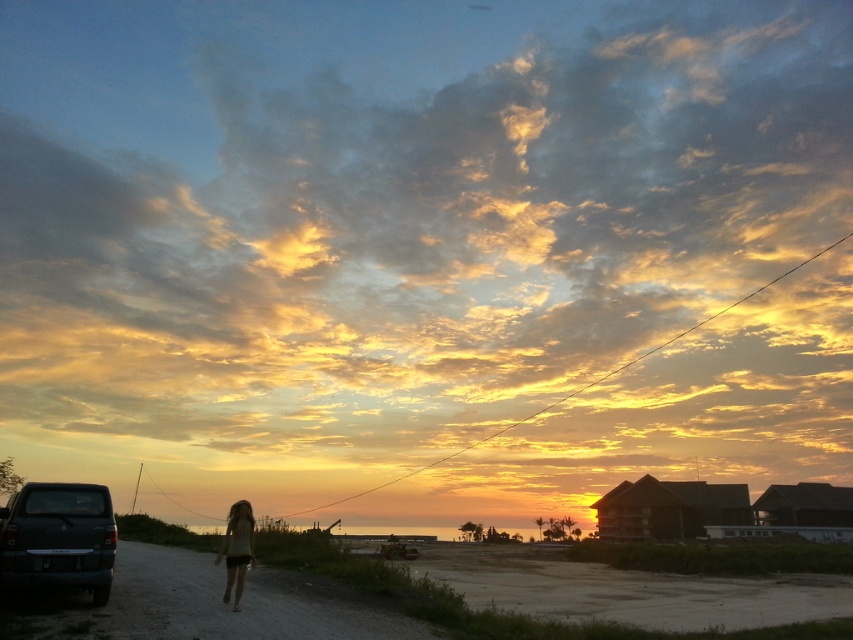
Question: Among these points, which one is nearest to the camera?

Choices:
 (A) (228, 532)
 (B) (45, 525)

Answer: (B)

Question: Does matte black truck at lower left appear on the left side of beige cotton shorts at lower left?

Choices:
 (A) yes
 (B) no

Answer: (B)

Question: Does matte black truck at lower left appear on the right side of beige cotton shorts at lower left?

Choices:
 (A) yes
 (B) no

Answer: (A)

Question: Can you confirm if matte black truck at lower left is wider than beige cotton shorts at lower left?

Choices:
 (A) no
 (B) yes

Answer: (A)

Question: Which object appears closest to the camera in this image?

Choices:
 (A) beige cotton shorts at lower left
 (B) matte black truck at lower left

Answer: (B)

Question: Among these points, which one is nearest to the camera?

Choices:
 (A) (9, 554)
 (B) (236, 561)

Answer: (A)